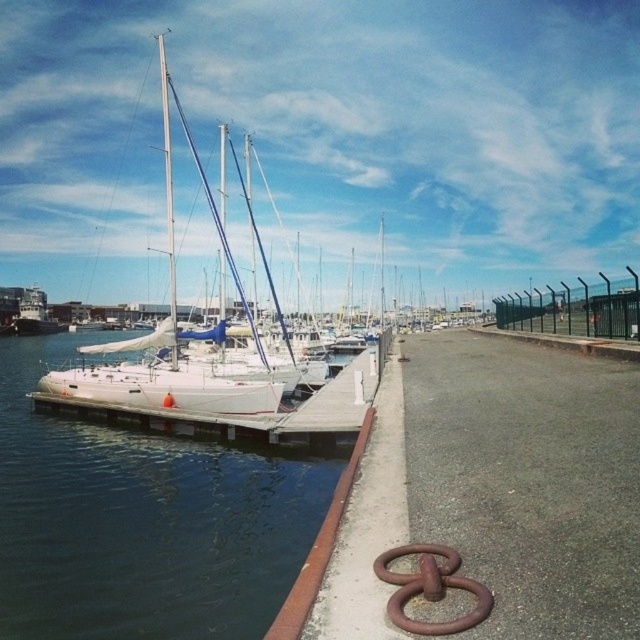
Can you confirm if white glossy sailboat at center is smaller than rusty metal ring at lower right?

No.

Who is more forward, (209, 392) or (483, 612)?

Point (483, 612)

Describe the element at coordinates (163, 348) in the screenshot. I see `white glossy sailboat at center` at that location.

I want to click on white glossy sailboat at center, so click(163, 348).

Is point (269, 632) more distant than point (170, 140)?

No, it is not.

Is point (280, 612) in front of point (172, 324)?

Yes.

Does point (332, 548) come in front of point (168, 276)?

That is True.

Locate an element on the screen. This screenshot has height=640, width=640. rusty metal curb at lower left is located at coordinates (320, 547).

Does rusty metal ring at lower right have a greater height compared to smooth white mast at center?

No, rusty metal ring at lower right is not taller than smooth white mast at center.

At what (x,y) coordinates should I click in order to perform the action: click on rusty metal ring at lower right. Please return your answer as a coordinate pair (x, y). Looking at the image, I should click on (429, 588).

Based on the photo, who is more distant from viewer, (481, 586) or (160, 68)?

The point (160, 68) is behind.

Find the location of a particular element. rusty metal ring at lower right is located at coordinates (429, 588).